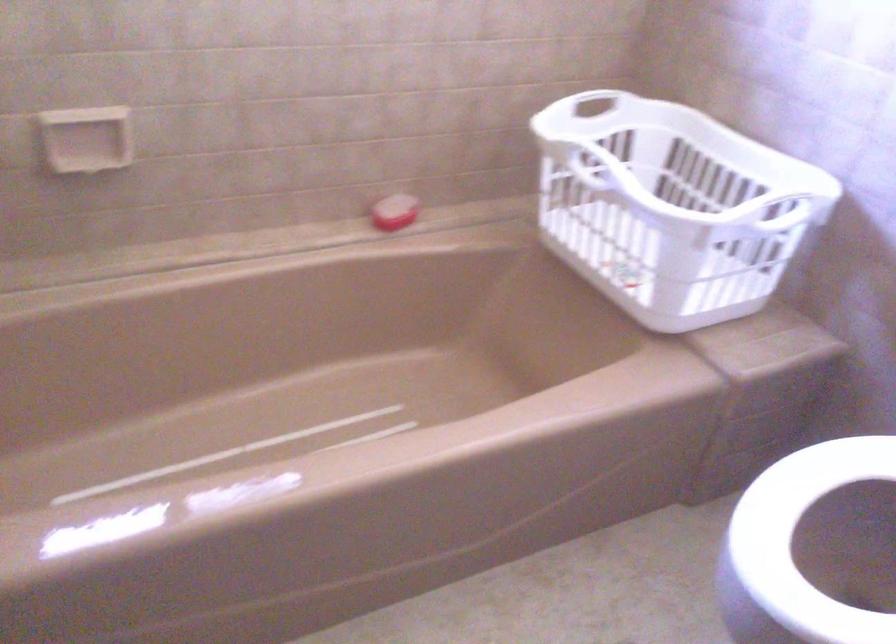
The height and width of the screenshot is (644, 896). What do you see at coordinates (796, 550) in the screenshot?
I see `the toilet lid` at bounding box center [796, 550].